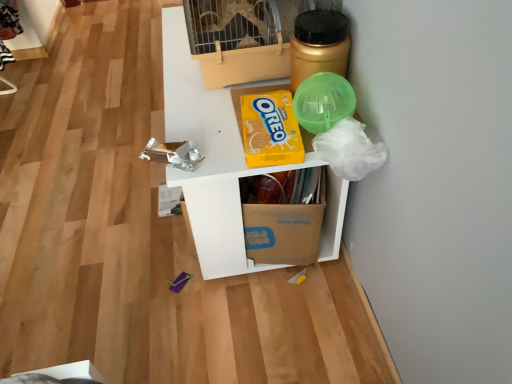
You are a GUI agent. You are given a task and a screenshot of the screen. Output one action in this format:
    pyautogui.click(x=<x>, y=<y>)
    Task: Click on the vacant area on the back side of yellow cardboard oreo at upper center
    The height and width of the screenshot is (384, 512).
    Given the screenshot: What is the action you would take?
    238,87